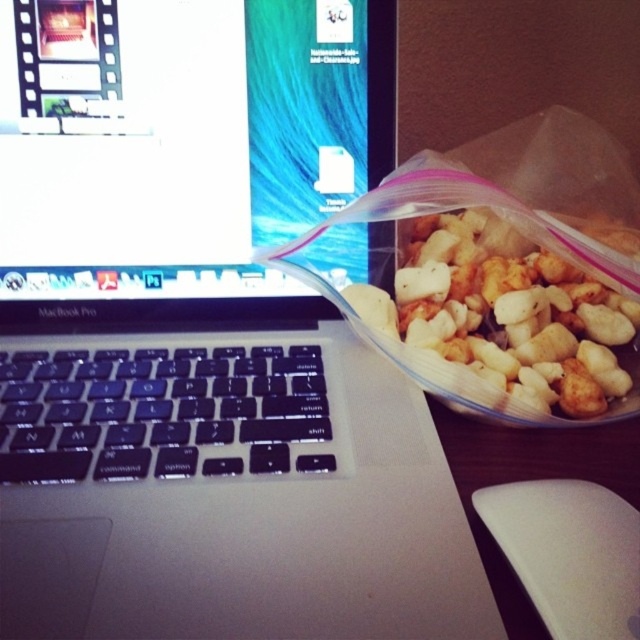
You are organizing your desk and need to place both the matte plastic computer screen at upper left and the white matte mouse at lower right into a storage box. The box can only hold items that are smaller than the mouse. Will both items fit?

The matte plastic computer screen at upper left is bigger than the white matte mouse at lower right, so it won

From the picture: You are a delivery person who just arrived at the workspace. You need to place a small package exactly at the center of the MacBook Pro laptop. However, there is an object at point (499, 289). Is there an object in the way of where you need to place the package? Please explain.

Yes, there is an object in the way. At point (499, 289) lies white matte nuts at center, which is located at the center of the MacBook Pro laptop. Therefore, placing the package there would interfere with the white matte nuts at center.

You are organizing items on a desk and need to place both the matte plastic computer screen at upper left and the white matte nuts at center. Based on their sizes, which item requires more horizontal space?

The matte plastic computer screen at upper left requires more horizontal space because its width surpasses that of the white matte nuts at center.